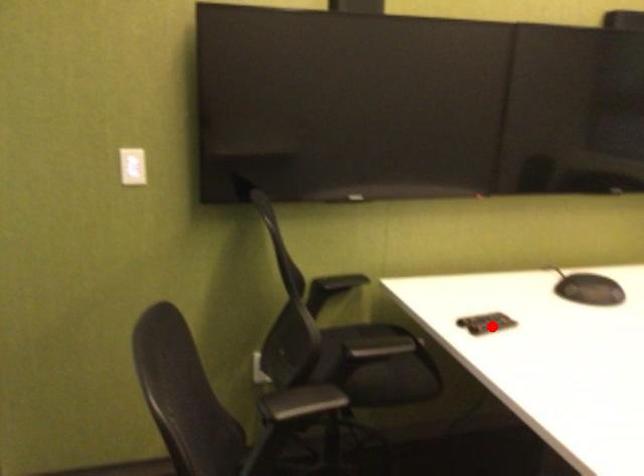
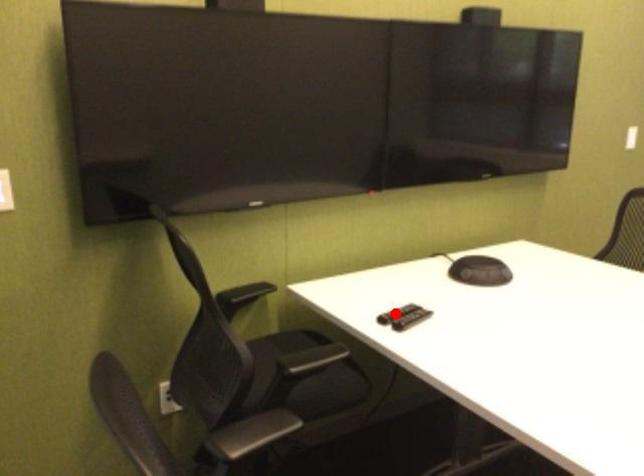
I am providing you with two images of the same scene from different viewpoints. A red point is marked on the first image and another point is marked on the second image. Is the red point in image1 aligned with the point shown in image2?

No